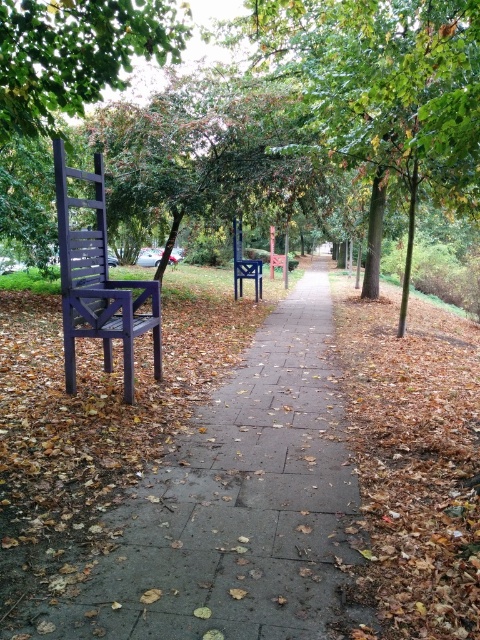
Question: Considering the relative positions of green leafy tree at upper left and matte purple chair at left in the image provided, where is green leafy tree at upper left located with respect to matte purple chair at left?

Choices:
 (A) right
 (B) left

Answer: (A)

Question: Which point is farther to the camera?

Choices:
 (A) (76, 10)
 (B) (84, 176)

Answer: (B)

Question: Does smooth concrete pavement at center have a smaller size compared to green leafy tree at upper left?

Choices:
 (A) yes
 (B) no

Answer: (A)

Question: Is smooth concrete pavement at center below matte purple chair at left?

Choices:
 (A) no
 (B) yes

Answer: (B)

Question: Among these points, which one is nearest to the camera?

Choices:
 (A) (240, 634)
 (B) (122, 58)
 (C) (94, 237)

Answer: (A)

Question: Which object is the closest to the green leafy tree at upper left?

Choices:
 (A) smooth concrete pavement at center
 (B) matte purple chair at left

Answer: (B)